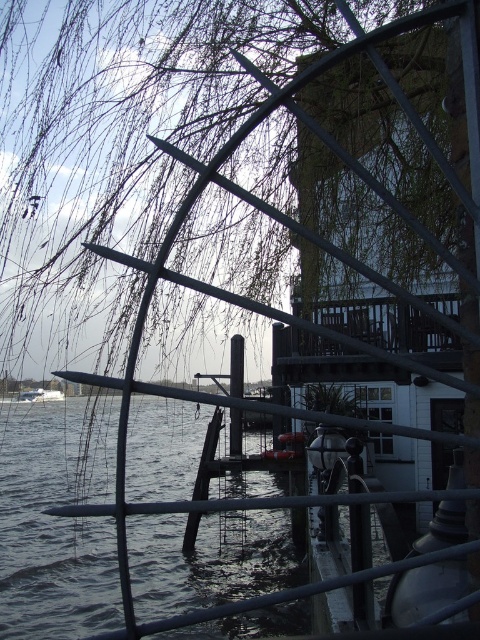
Question: Is green leafy tree at upper left smaller than white glossy boat at lower left?

Choices:
 (A) yes
 (B) no

Answer: (B)

Question: Among these objects, which one is farthest from the camera?

Choices:
 (A) white glossy boat at lower left
 (B) green leafy tree at upper left

Answer: (A)

Question: Which point is farther to the camera?

Choices:
 (A) green leafy tree at upper left
 (B) white glossy boat at lower left

Answer: (B)

Question: Does green leafy tree at upper left lie in front of white glossy boat at lower left?

Choices:
 (A) yes
 (B) no

Answer: (A)

Question: Does green leafy tree at upper left have a lesser width compared to white glossy boat at lower left?

Choices:
 (A) yes
 (B) no

Answer: (B)